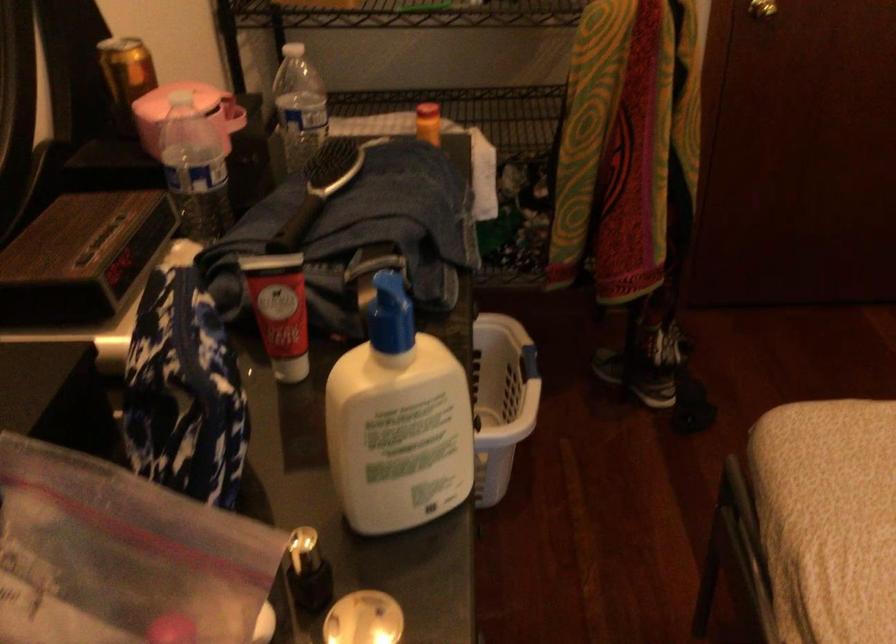
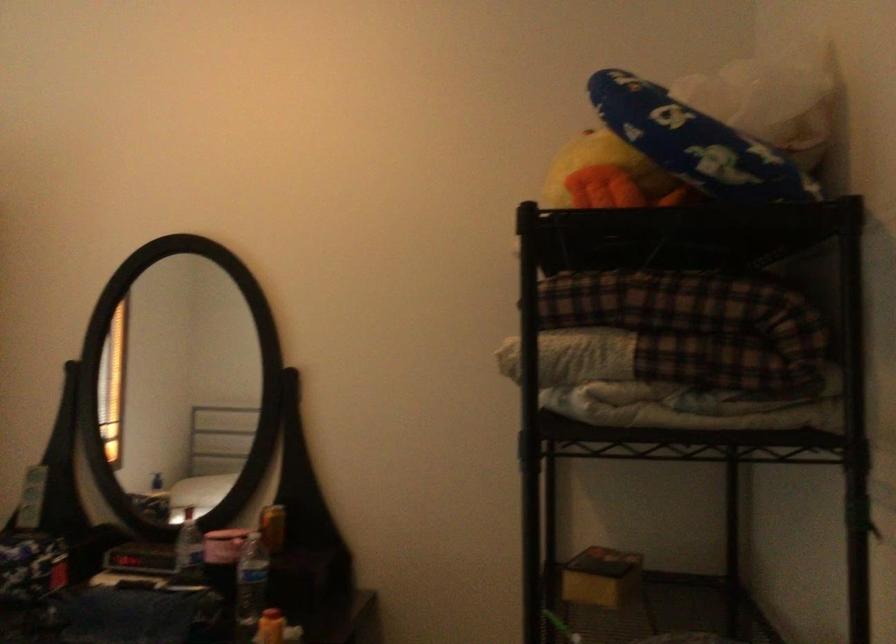
Locate, in the second image, the point that corresponds to the point at 434,127 in the first image.

(270, 627)